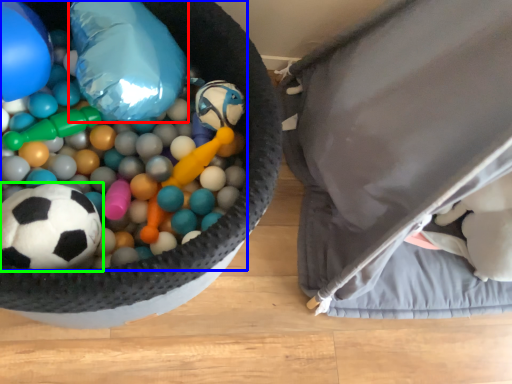
Question: Estimate the real-world distances between objects in this image. Which object is closer to balloon (highlighted by a red box), toy (highlighted by a blue box) or football (highlighted by a green box)?

Choices:
 (A) toy
 (B) football

Answer: (A)